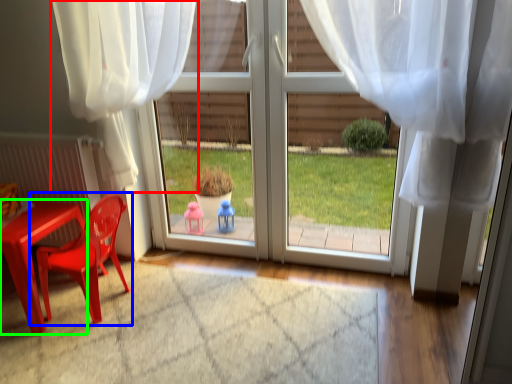
Question: Which is farther away from curtain (highlighted by a red box)? chair (highlighted by a blue box) or table (highlighted by a green box)?

Choices:
 (A) chair
 (B) table

Answer: (B)